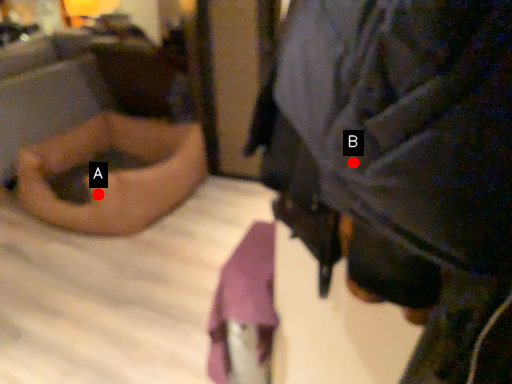
Question: Two points are circled on the image, labeled by A and B beside each circle. Which point appears closest to the camera in this image?

Choices:
 (A) A is closer
 (B) B is closer

Answer: (B)